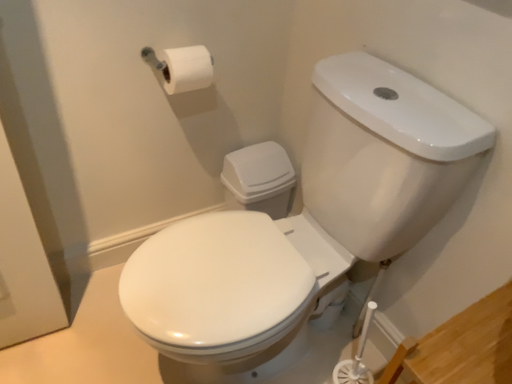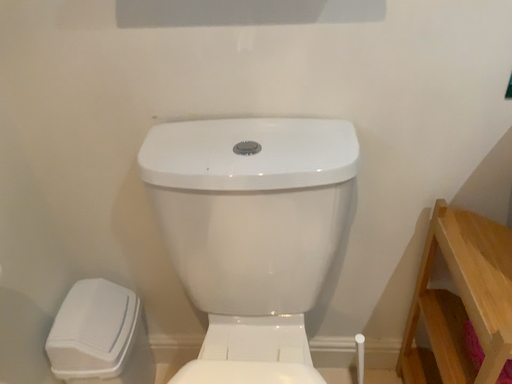
Question: How did the camera likely rotate when shooting the video?

Choices:
 (A) rotated upward
 (B) rotated downward

Answer: (A)